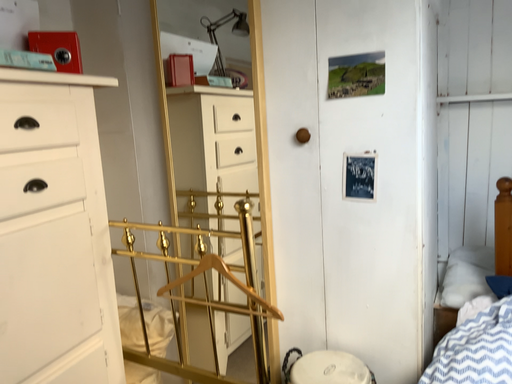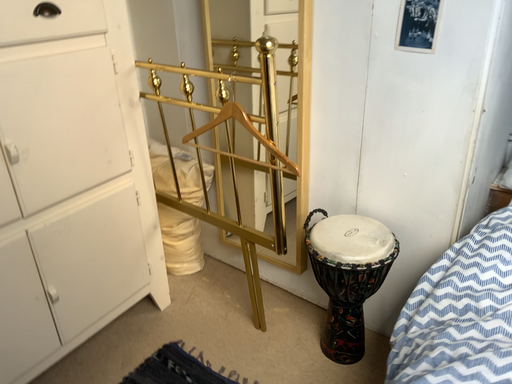
Question: Which way did the camera rotate in the video?

Choices:
 (A) rotated downward
 (B) rotated upward

Answer: (A)